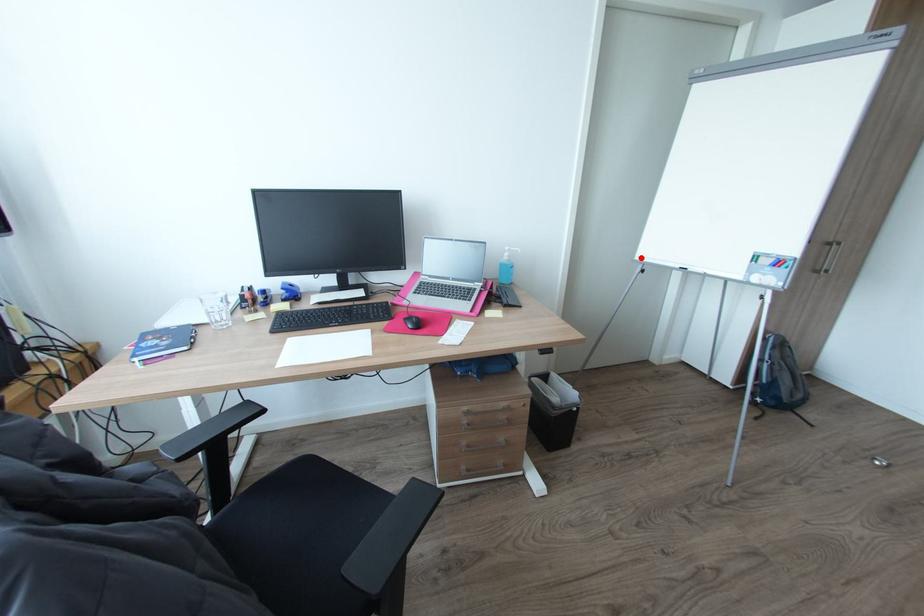
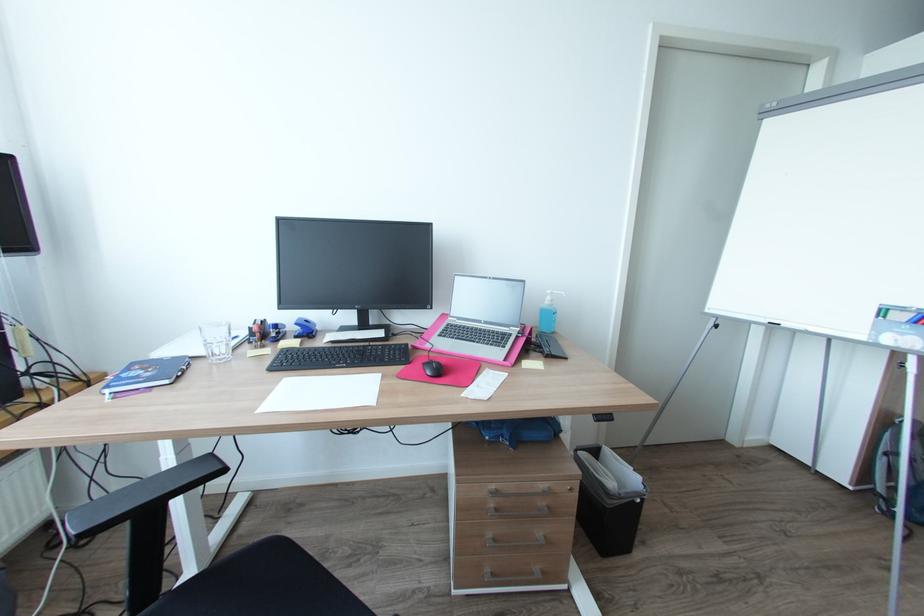
The point at the highlighted location is marked in the first image. Where is the corresponding point in the second image?

(712, 310)